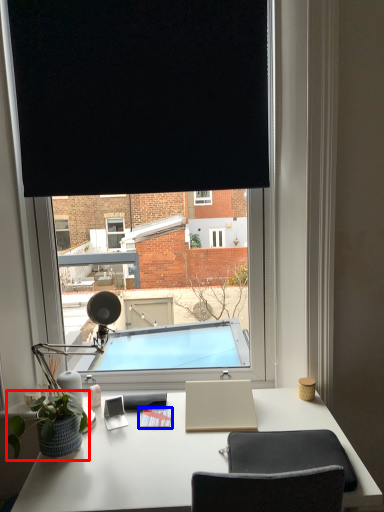
Question: Which object is further to the camera taking this photo, houseplant (highlighted by a red box) or notepad (highlighted by a blue box)?

Choices:
 (A) houseplant
 (B) notepad

Answer: (B)